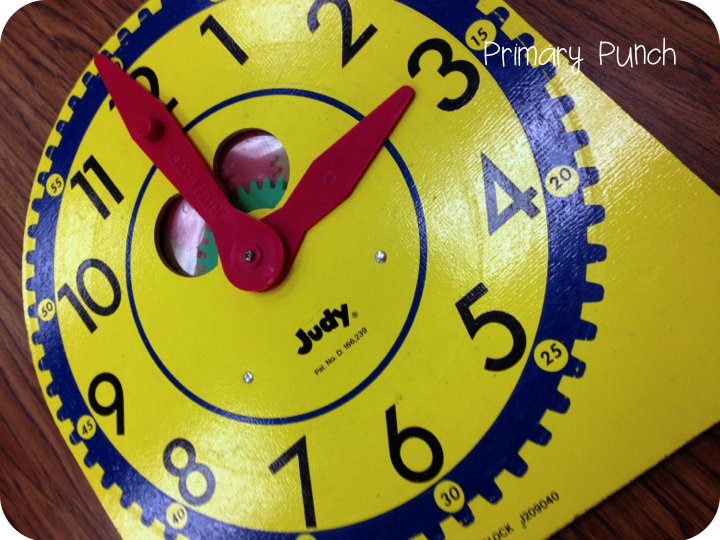
Find the location of `table`. table is located at coordinates (672, 519).